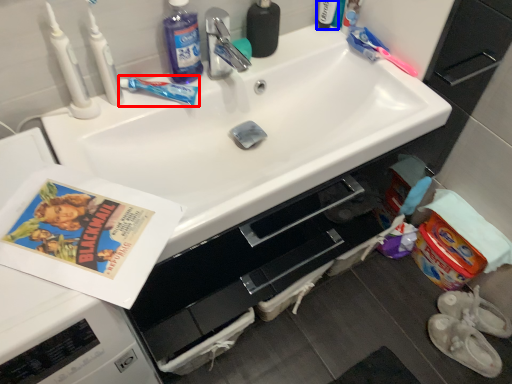
Question: Which point is further to the camera, toothbrush (highlighted by a red box) or toiletry (highlighted by a blue box)?

Choices:
 (A) toothbrush
 (B) toiletry

Answer: (B)